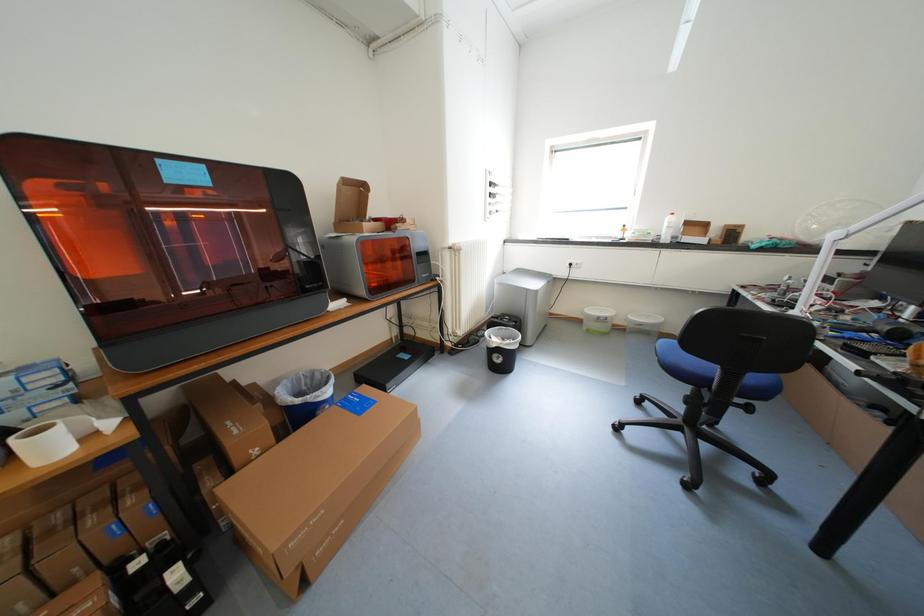
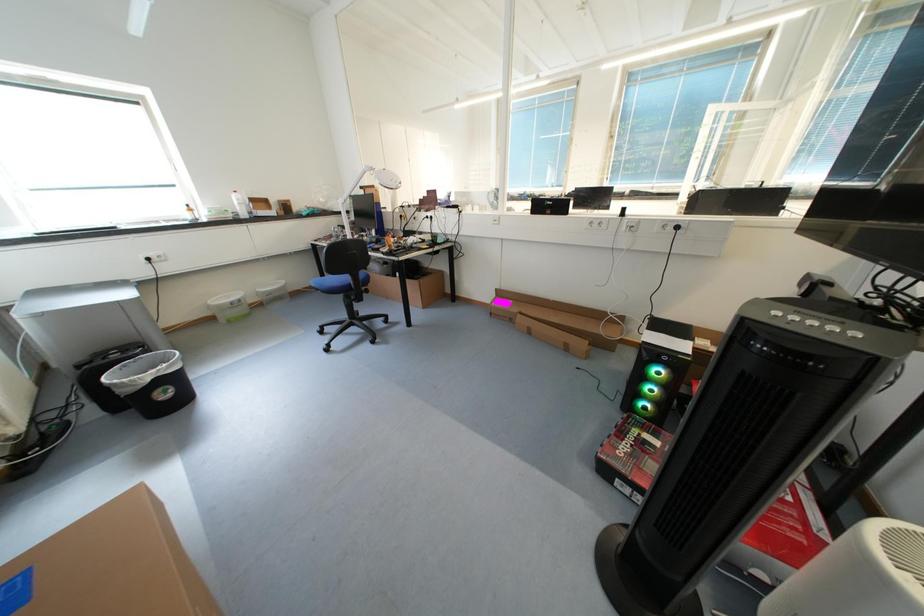
The images are taken continuously from a first-person perspective. In which direction is your viewpoint rotating?

The camera's rotation is toward right-down.